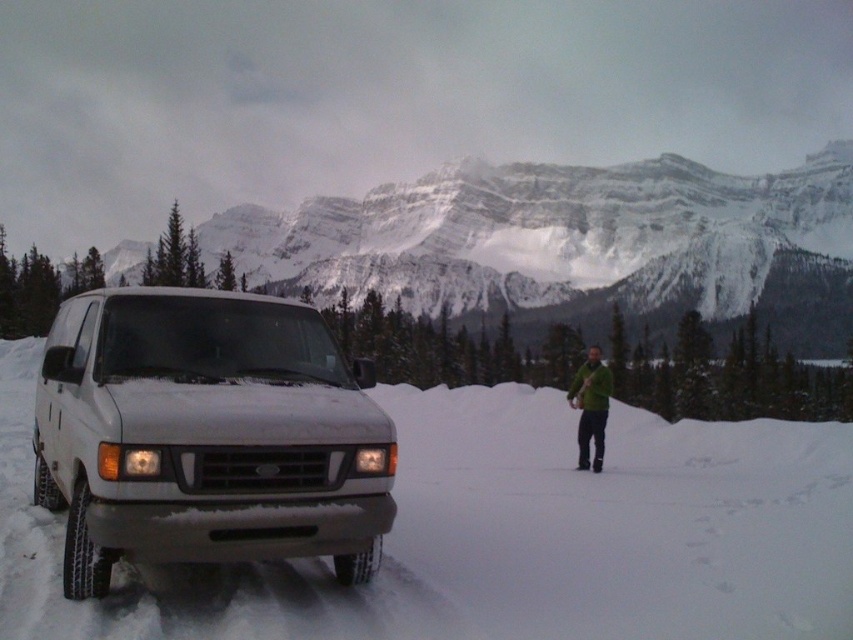
What do you see at coordinates (497, 534) in the screenshot? I see `white powdery snow at center` at bounding box center [497, 534].

In the scene shown: Is white powdery snow at center positioned at the back of snowy granite mountain at upper center?

No, it is not.

You are a GUI agent. You are given a task and a screenshot of the screen. Output one action in this format:
    pyautogui.click(x=<x>, y=<y>)
    Task: Click on the white powdery snow at center
    This screenshot has height=640, width=853.
    Given the screenshot: What is the action you would take?
    pyautogui.click(x=497, y=534)

Can you confirm if white powdery snow at center is positioned below white matte suv at left?

Yes.

Measure the distance from white powdery snow at center to white matte suv at left.

white powdery snow at center and white matte suv at left are 18.79 meters apart from each other.

Locate an element on the screen. white powdery snow at center is located at coordinates (497, 534).

How much distance is there between snowy granite mountain at upper center and white matte suv at left?

They are 646.68 feet apart.

Is snowy granite mountain at upper center in front of white matte suv at left?

No, snowy granite mountain at upper center is behind white matte suv at left.

Does point (311, 243) come farther from viewer compared to point (129, 349)?

Yes.

This screenshot has height=640, width=853. Find the location of `snowy granite mountain at upper center`. snowy granite mountain at upper center is located at coordinates (573, 244).